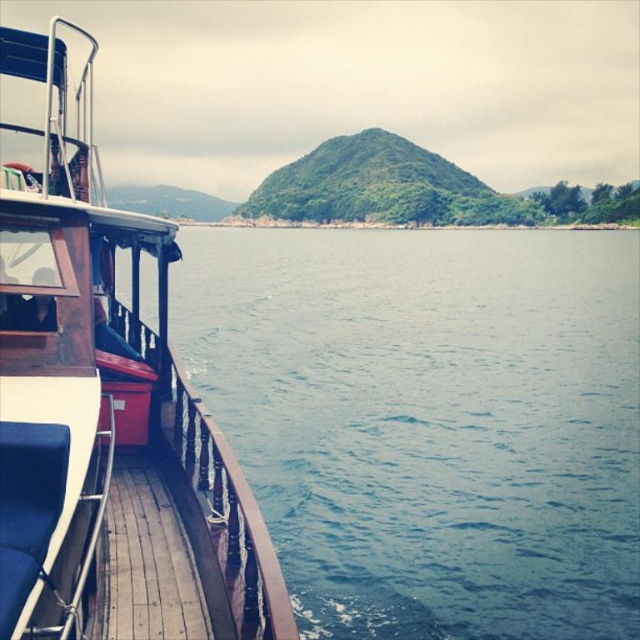
You are standing on the boat deck and want to reach the point marked at coordinates point [8,285]. If your reach extends 1.5 meters, can you touch it without moving your feet?

The point [8,285] is 6.96 meters away from the viewer. Since your reach only extends 1.5 meters, you cannot touch it without moving your feet.

Based on the photo, you are standing on the wooden deck boat at left and want to move to the wooden at left. Considering their widths, which object has a larger space to move around on?

The wooden deck boat at left has a greater width than the wooden at left, so there is more space to move around on the wooden deck boat at left.

You are standing on the boat deck and want to place a 1.5 meter long wooden board between the wooden rail at lower left and the wooden at left. Is there enough space for it?

The wooden rail at lower left is 1.26 meters from the wooden at left. Since the board is 1.5 meters long, it is longer than the available space, so it won